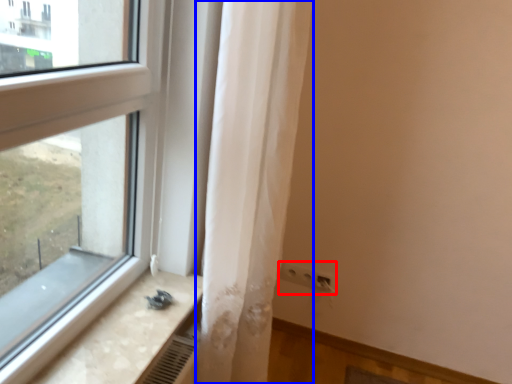
Question: Which object is further to the camera taking this photo, electric outlet (highlighted by a red box) or curtain (highlighted by a blue box)?

Choices:
 (A) electric outlet
 (B) curtain

Answer: (A)